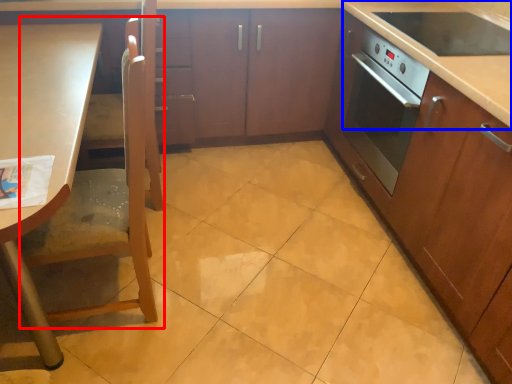
Question: Which object is further to the camera taking this photo, chair (highlighted by a red box) or counter top (highlighted by a blue box)?

Choices:
 (A) chair
 (B) counter top

Answer: (B)